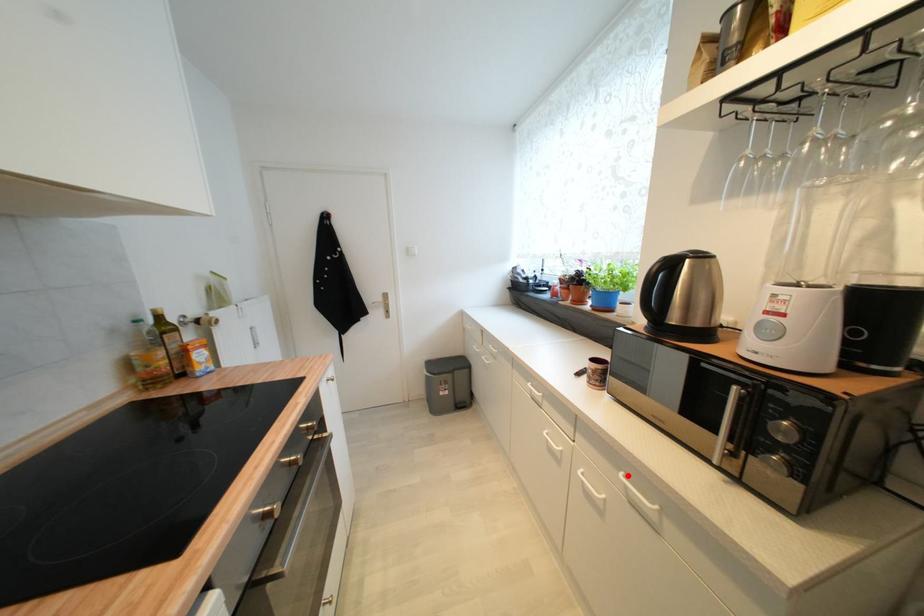
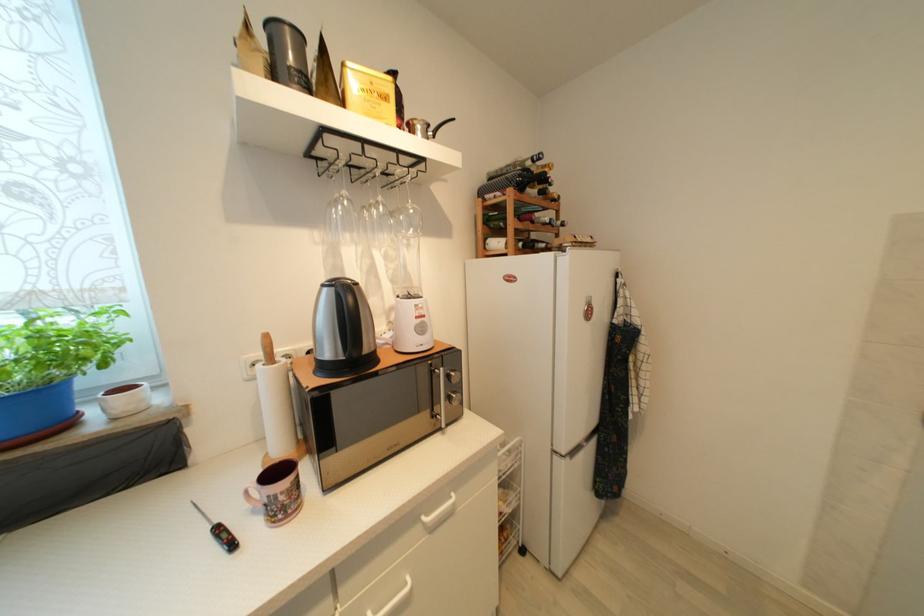
Where in the second image is the point corresponding to the highlighted location from the first image?

(429, 521)